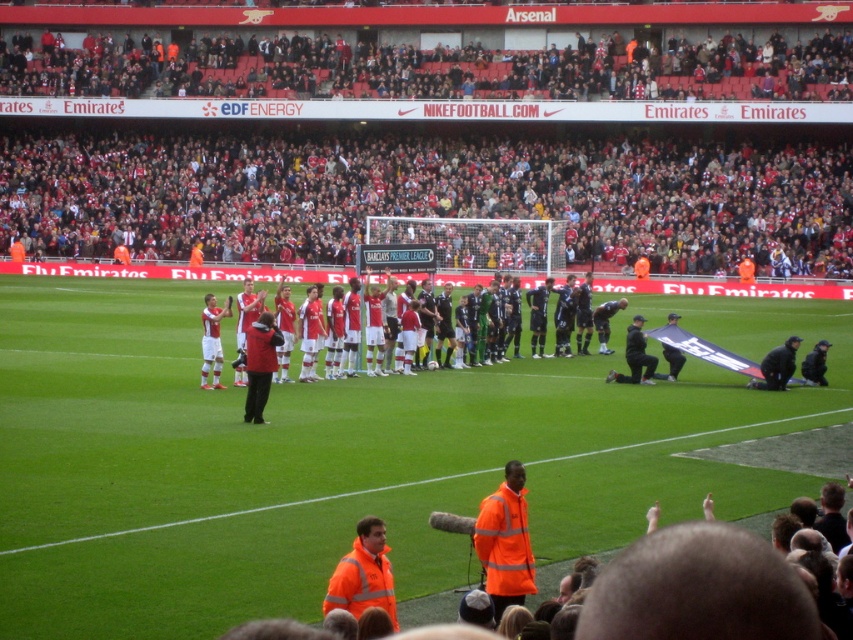
Question: Does red fabric crowd at upper center come behind high visibility jacket at center?

Choices:
 (A) no
 (B) yes

Answer: (B)

Question: Considering the relative positions of red matte jacket at center and dark blue jersey at center in the image provided, where is red matte jacket at center located with respect to dark blue jersey at center?

Choices:
 (A) above
 (B) below

Answer: (B)

Question: Considering the real-world distances, which object is farthest from the red matte jacket at center?

Choices:
 (A) dark blue jacket at center
 (B) black fabric jacket at lower right
 (C) high visibility jacket at center
 (D) high visibility orange jacket at lower center

Answer: (D)

Question: Which point appears closest to the camera in this image?

Choices:
 (A) (270, 381)
 (B) (608, 308)
 (C) (651, 381)
 (D) (824, 381)

Answer: (A)

Question: Is red fabric crowd at upper center above dark blue jersey at center?

Choices:
 (A) yes
 (B) no

Answer: (A)

Question: Estimate the real-world distances between objects in this image. Which object is farther from the high visibility jacket at center?

Choices:
 (A) red matte jacket at center
 (B) dark blue jacket at center
 (C) black leather jacket at center

Answer: (B)